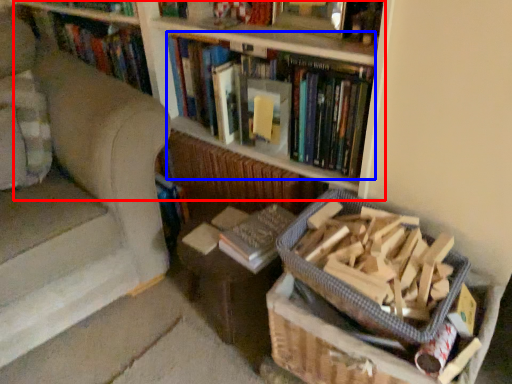
Question: Which object appears farthest to the camera in this image, bookcase (highlighted by a red box) or book (highlighted by a blue box)?

Choices:
 (A) bookcase
 (B) book

Answer: (B)